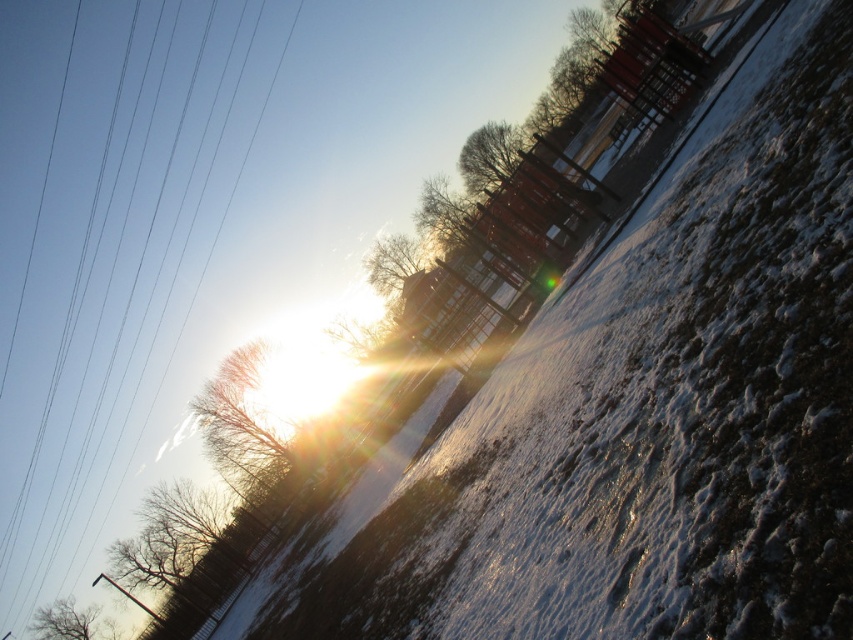
Question: Can you confirm if bare branches at upper center is smaller than brown textured tree at lower left?

Choices:
 (A) no
 (B) yes

Answer: (A)

Question: Can you confirm if brown leafless tree at lower left is positioned to the left of brown textured tree at lower left?

Choices:
 (A) no
 (B) yes

Answer: (A)

Question: Is brown textured tree at upper left wider than brown textured tree at lower left?

Choices:
 (A) yes
 (B) no

Answer: (A)

Question: Based on their relative distances, which object is farther from the bare branches at upper center?

Choices:
 (A) black wire at upper left
 (B) brown leafless tree at lower left
 (C) brown textured tree at upper left
 (D) bare branches at center

Answer: (A)

Question: Which of the following is the closest to the observer?

Choices:
 (A) (451, 211)
 (B) (74, 609)
 (C) (515, 145)
 (D) (202, 499)

Answer: (D)

Question: Which of the following is the closest to the observer?

Choices:
 (A) bare branches at upper center
 (B) brown textured tree at upper left
 (C) bare brown tree at upper center
 (D) black wire at upper left

Answer: (B)